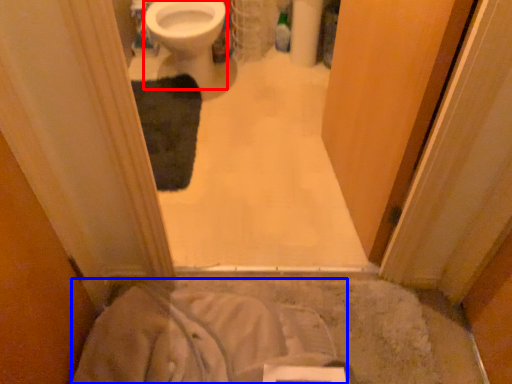
Question: Which of the following is the farthest to the observer, bidet (highlighted by a red box) or sheet (highlighted by a blue box)?

Choices:
 (A) bidet
 (B) sheet

Answer: (A)